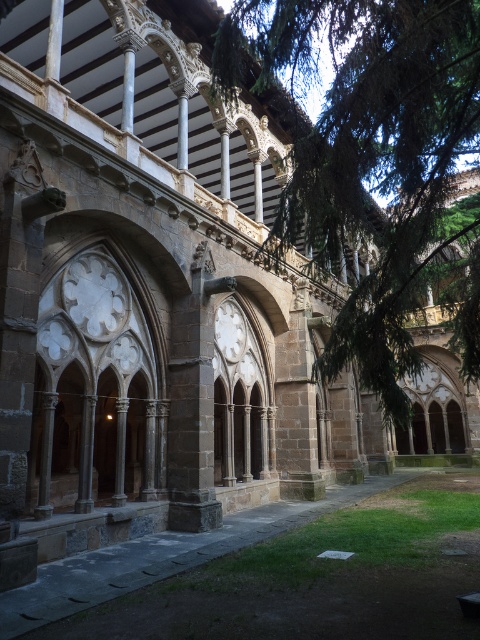
You are standing in the historic cloister and want to take a photo of the green leafy tree at center. If your camera has a maximum focus range of 10 meters, will it be able to capture the tree clearly?

The green leafy tree at center and viewer are 9.14 meters apart, so yes, the camera can focus on the tree since the distance is within the 10 meters maximum range.

From the picture: You are a visitor in the cloister and want to take a photo of the green leafy tree at center without any obstructions. Is the brown stone walkway at lower center blocking your view of the tree?

The brown stone walkway at lower center is behind the green leafy tree at center, so it won t block your view of the tree.

You are standing at the entrance of the historic cloister and want to find the green leafy tree at center. According to the coordinates provided, in which direction should you walk to reach it?

The green leafy tree at center is located at coordinates point (376, 164). Since the coordinates are relative to the image, you should walk towards the center of the cloister to reach it.